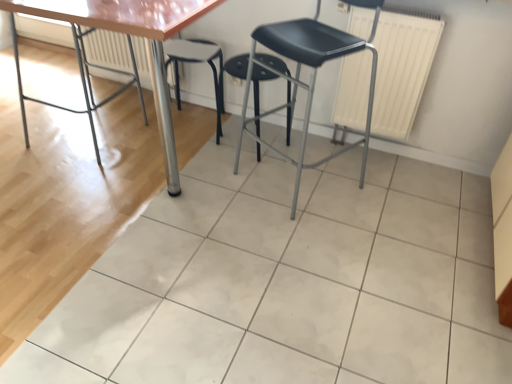
The image size is (512, 384). In order to click on vacant space to the right of matte black stool at center in this screenshot , I will do `click(382, 193)`.